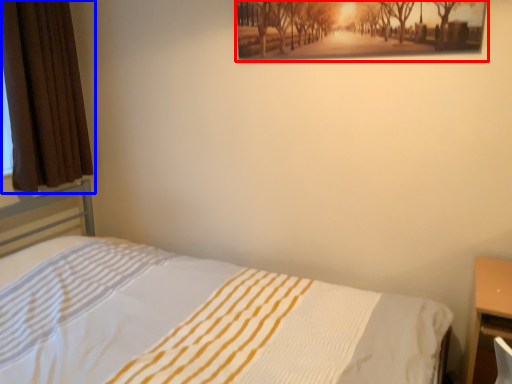
Question: Which point is further to the camera, picture frame (highlighted by a red box) or curtain (highlighted by a blue box)?

Choices:
 (A) picture frame
 (B) curtain

Answer: (B)